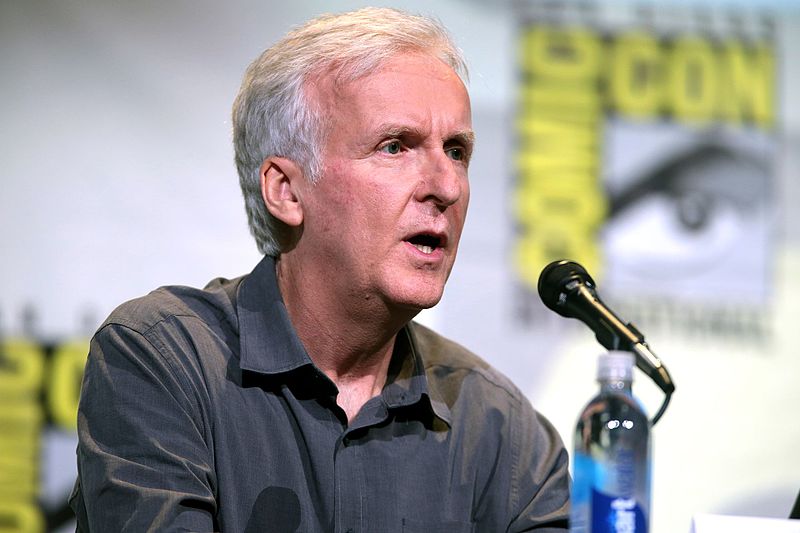
This screenshot has width=800, height=533. I want to click on wall, so click(42, 177).